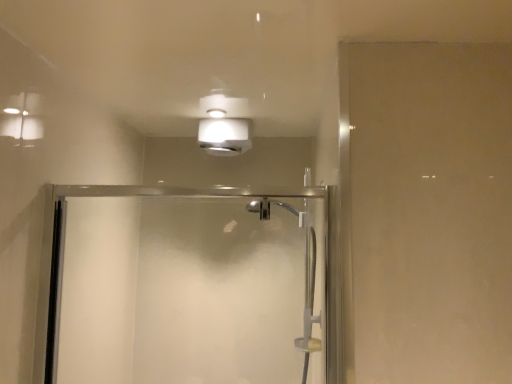
What do you see at coordinates (189, 286) in the screenshot?
I see `clear glass shower door at center` at bounding box center [189, 286].

Find the location of a particular element. The height and width of the screenshot is (384, 512). clear glass shower door at center is located at coordinates (189, 286).

Measure the distance between clear glass shower door at center and camera.

clear glass shower door at center is 3.66 feet away from camera.

Image resolution: width=512 pixels, height=384 pixels. I want to click on white matte light fixture at upper center, so click(224, 125).

Consider the image. What is the approximate height of white matte light fixture at upper center?

It is 5.67 inches.

The width and height of the screenshot is (512, 384). What do you see at coordinates (224, 125) in the screenshot?
I see `white matte light fixture at upper center` at bounding box center [224, 125].

The image size is (512, 384). Find the location of `clear glass shower door at center`. clear glass shower door at center is located at coordinates (189, 286).

Does clear glass shower door at center appear on the left side of white matte light fixture at upper center?

Yes, clear glass shower door at center is to the left of white matte light fixture at upper center.

Consider the image. Does clear glass shower door at center lie in front of white matte light fixture at upper center?

Yes, the depth of clear glass shower door at center is less than that of white matte light fixture at upper center.

Does point (333, 380) come closer to viewer compared to point (234, 112)?

Yes.

From the image's perspective, would you say clear glass shower door at center is shown under white matte light fixture at upper center?

Indeed, from the image's perspective, clear glass shower door at center is shown beneath white matte light fixture at upper center.

From a real-world perspective, which is physically below, clear glass shower door at center or white matte light fixture at upper center?

clear glass shower door at center, from a real-world perspective.

Is clear glass shower door at center wider than white matte light fixture at upper center?

In fact, clear glass shower door at center might be narrower than white matte light fixture at upper center.

From their relative heights in the image, would you say clear glass shower door at center is taller or shorter than white matte light fixture at upper center?

Considering their sizes, clear glass shower door at center has more height than white matte light fixture at upper center.

Based on the photo, between clear glass shower door at center and white matte light fixture at upper center, which one has larger size?

clear glass shower door at center.

Is clear glass shower door at center spatially inside white matte light fixture at upper center, or outside of it?

clear glass shower door at center is not inside white matte light fixture at upper center, it's outside.

Are clear glass shower door at center and white matte light fixture at upper center far apart?

No, there isn't a large distance between clear glass shower door at center and white matte light fixture at upper center.

Does clear glass shower door at center turn towards white matte light fixture at upper center?

No.

Measure the distance from clear glass shower door at center to white matte light fixture at upper center.

clear glass shower door at center and white matte light fixture at upper center are 25.07 inches apart from each other.

You are a GUI agent. You are given a task and a screenshot of the screen. Output one action in this format:
    pyautogui.click(x=<x>, y=<y>)
    Task: Click on the light fixture on the right of clear glass shower door at center
    This screenshot has width=512, height=384.
    Given the screenshot: What is the action you would take?
    pyautogui.click(x=224, y=125)

Is white matte light fixture at upper center to the right of clear glass shower door at center from the viewer's perspective?

Correct, you'll find white matte light fixture at upper center to the right of clear glass shower door at center.

In the scene shown: Is white matte light fixture at upper center further to the viewer compared to clear glass shower door at center?

Yes, white matte light fixture at upper center is further from the viewer.

Is point (208, 112) in front of point (327, 208)?

No, it is behind (327, 208).

Consider the image. From the image's perspective, is white matte light fixture at upper center located above or below clear glass shower door at center?

white matte light fixture at upper center is situated higher than clear glass shower door at center in the image.

From a real-world perspective, is white matte light fixture at upper center positioned above or below clear glass shower door at center?

white matte light fixture at upper center is situated higher than clear glass shower door at center in the real world.

Considering the sizes of objects white matte light fixture at upper center and clear glass shower door at center in the image provided, who is wider, white matte light fixture at upper center or clear glass shower door at center?

Wider between the two is white matte light fixture at upper center.

Between white matte light fixture at upper center and clear glass shower door at center, which one has less height?

white matte light fixture at upper center.

Is white matte light fixture at upper center bigger than clear glass shower door at center?

Incorrect, white matte light fixture at upper center is not larger than clear glass shower door at center.

Which is correct: white matte light fixture at upper center is inside clear glass shower door at center, or outside of it?

white matte light fixture at upper center is not inside clear glass shower door at center, it's outside.

Is white matte light fixture at upper center far away from clear glass shower door at center?

They are positioned close to each other.

Is white matte light fixture at upper center turned away from clear glass shower door at center?

No.

What's the angular difference between white matte light fixture at upper center and clear glass shower door at center's facing directions?

3.03 degrees.

How distant is white matte light fixture at upper center from clear glass shower door at center?

The distance of white matte light fixture at upper center from clear glass shower door at center is 63.69 centimeters.

Locate an element on the screen. screen door on the left of white matte light fixture at upper center is located at coordinates (189, 286).

You are a GUI agent. You are given a task and a screenshot of the screen. Output one action in this format:
    pyautogui.click(x=<x>, y=<y>)
    Task: Click on the screen door lying below the white matte light fixture at upper center (from the image's perspective)
    The image size is (512, 384).
    Given the screenshot: What is the action you would take?
    tap(189, 286)

In the image, there is a clear glass shower door at center. Where is `light fixture above it (from the image's perspective)`? light fixture above it (from the image's perspective) is located at coordinates (224, 125).